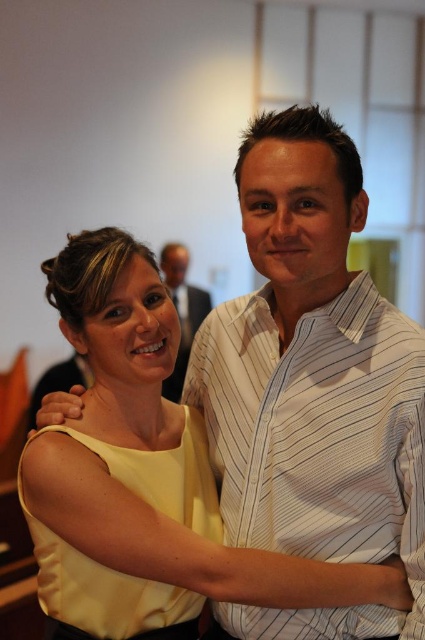
You are at a social event and want to take a photo of the two people. You notice two points in the background at coordinates point (237, 545) and point (146, 609). Which point is closer to the camera?

Point (237, 545) is further to the camera than point (146, 609), so point (146, 609) is closer to the camera.

You are a photographer at a social event. You want to take a photo of the white striped shirt at center and the matte black suit at center. Which one is closer to the camera?

The white striped shirt at center is in front of the matte black suit at center, so the white striped shirt at center is closer to the camera.